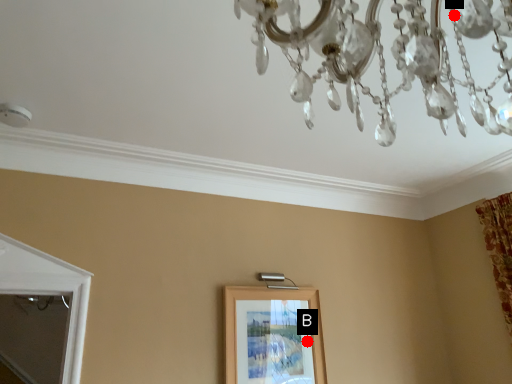
Question: Two points are circled on the image, labeled by A and B beside each circle. Among these points, which one is nearest to the camera?

Choices:
 (A) A is closer
 (B) B is closer

Answer: (A)